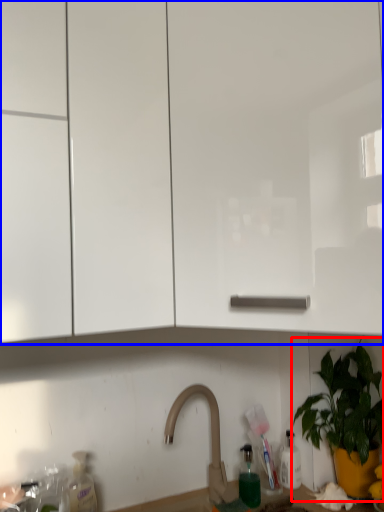
Question: Which object appears farthest to the camera in this image, houseplant (highlighted by a red box) or cabinetry (highlighted by a blue box)?

Choices:
 (A) houseplant
 (B) cabinetry

Answer: (A)